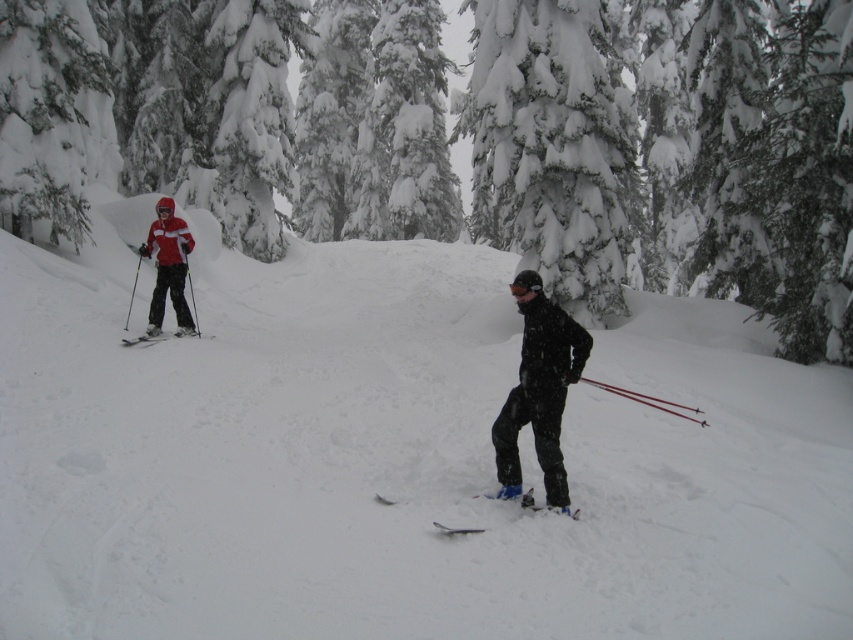
Question: Is white fluffy snow at center above matte black ski suit at center?

Choices:
 (A) yes
 (B) no

Answer: (A)

Question: Which is nearer to the white fluffy snow at center?

Choices:
 (A) matte black skis at left
 (B) matte black ski suit at center
 (C) matte red ski suit at left

Answer: (C)

Question: Among these points, which one is farthest from the camera?

Choices:
 (A) (163, 308)
 (B) (190, 333)
 (C) (466, 532)

Answer: (B)

Question: Can you confirm if white fluffy snow at center is positioned above blue matte ski at center?

Choices:
 (A) no
 (B) yes

Answer: (B)

Question: Considering the real-world distances, which object is closest to the snowy evergreen tree at center?

Choices:
 (A) blue matte ski at center
 (B) white fluffy snow at center

Answer: (B)

Question: Can you confirm if matte red ski suit at left is positioned to the left of blue matte ski at center?

Choices:
 (A) yes
 (B) no

Answer: (A)